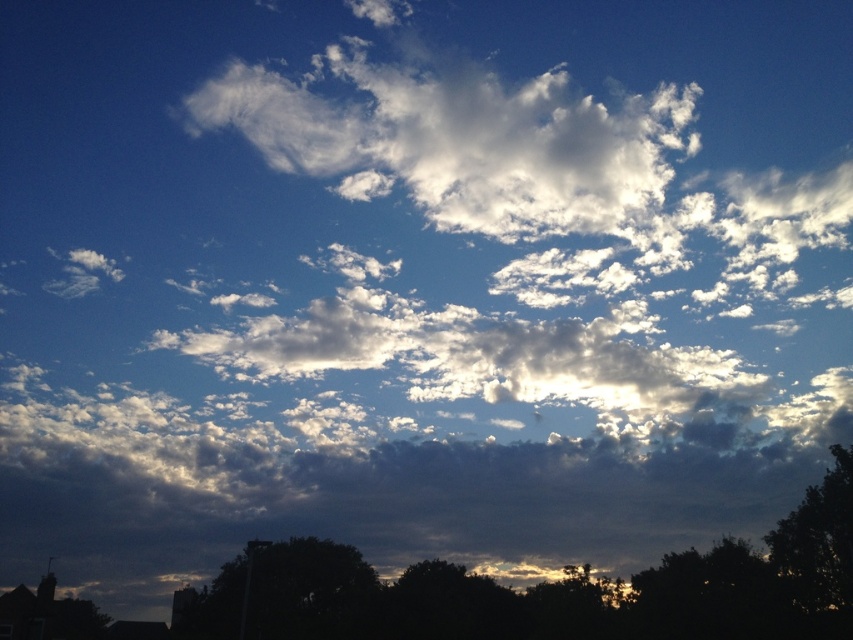
Which is more to the right, dark green leafy tree at lower center or dark green leafy tree at lower right?

dark green leafy tree at lower right

Who is shorter, dark green leafy tree at lower center or dark green leafy tree at lower right?

dark green leafy tree at lower center is shorter.

I want to click on dark green leafy tree at lower center, so click(x=285, y=595).

Does dark green leafy tree at lower left have a greater width compared to dark green leafy tree at lower center?

Yes, dark green leafy tree at lower left is wider than dark green leafy tree at lower center.

Does dark green leafy tree at lower left have a greater height compared to dark green leafy tree at lower center?

Indeed, dark green leafy tree at lower left has a greater height compared to dark green leafy tree at lower center.

You are a GUI agent. You are given a task and a screenshot of the screen. Output one action in this format:
    pyautogui.click(x=<x>, y=<y>)
    Task: Click on the dark green leafy tree at lower left
    This screenshot has height=640, width=853.
    Given the screenshot: What is the action you would take?
    pyautogui.click(x=547, y=589)

Where is `dark green leafy tree at lower left`? dark green leafy tree at lower left is located at coordinates (547, 589).

Can you confirm if dark green leafy tree at lower left is taller than dark green leafy tree at lower right?

Yes, dark green leafy tree at lower left is taller than dark green leafy tree at lower right.

Is point (846, 516) behind point (813, 496)?

No, it is not.

At what (x,y) coordinates should I click in order to perform the action: click on dark green leafy tree at lower left. Please return your answer as a coordinate pair (x, y). The width and height of the screenshot is (853, 640). Looking at the image, I should click on (547, 589).